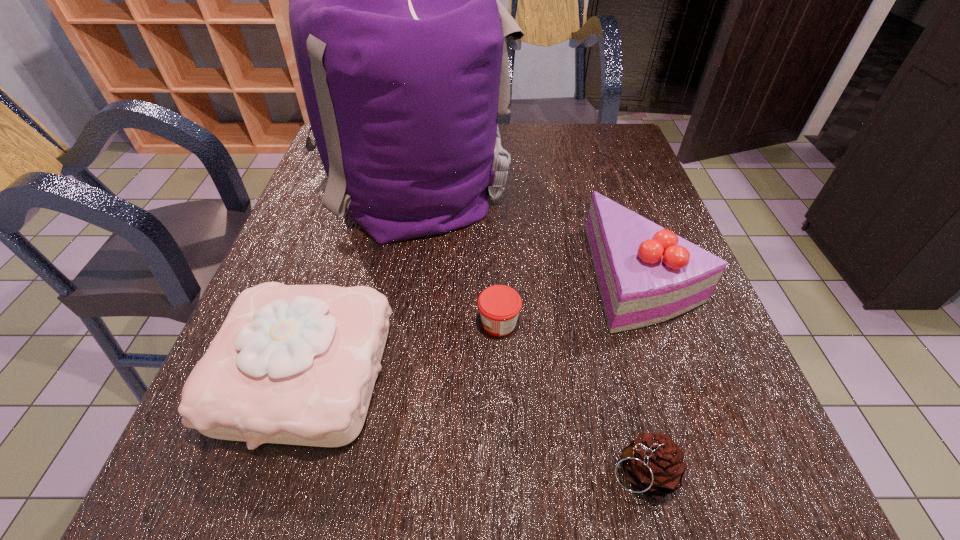
In order to click on free space located with a leaf charm attached to the pinecone in this screenshot , I will do 539,472.

The height and width of the screenshot is (540, 960). Find the location of `vacant area situated 0.390m with a leaf charm attached to the pinecone`. vacant area situated 0.390m with a leaf charm attached to the pinecone is located at coordinates (342, 472).

I want to click on vacant area situated 0.200m with a leaf charm attached to the pinecone, so click(x=470, y=472).

The width and height of the screenshot is (960, 540). In order to click on vacant space located on the label side of the shortest object in this screenshot , I will do `click(352, 323)`.

You are a GUI agent. You are given a task and a screenshot of the screen. Output one action in this format:
    pyautogui.click(x=<x>, y=<y>)
    Task: Click on the vacant position located on the label side of the shortest object
    This screenshot has height=540, width=960.
    Given the screenshot: What is the action you would take?
    pyautogui.click(x=342, y=323)

Locate an element on the screen. The image size is (960, 540). vacant space positioned 0.260m on the label side of the shortest object is located at coordinates (342, 323).

The width and height of the screenshot is (960, 540). Identify the location of object at the far edge. (401, 43).

The height and width of the screenshot is (540, 960). What are the coordinates of `object that is at the near edge` in the screenshot? It's located at (654, 464).

This screenshot has width=960, height=540. I want to click on backpack located at the left edge, so click(x=401, y=43).

The width and height of the screenshot is (960, 540). Identify the location of cake situated at the left edge. (292, 364).